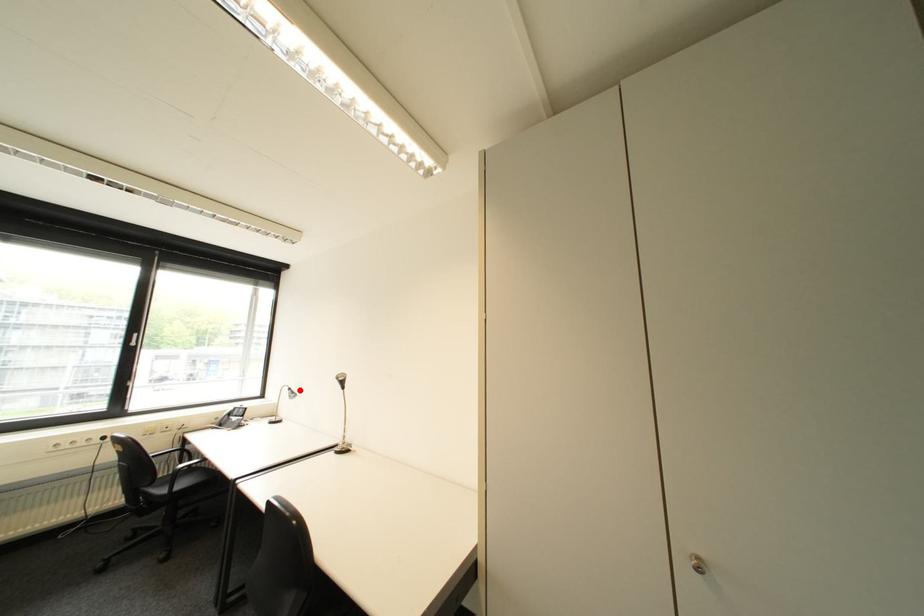
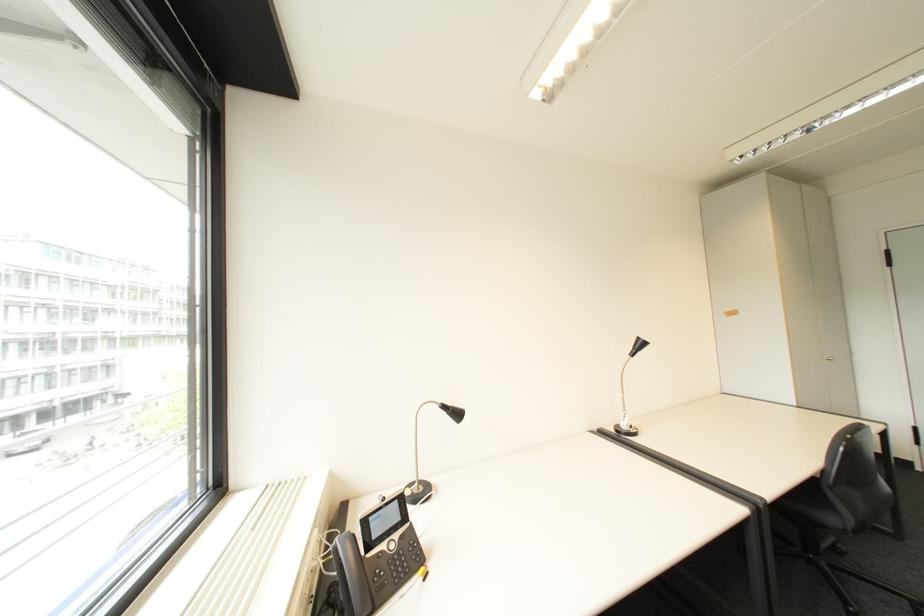
Find the pixel in the second image that matches the highlighted location in the first image.

(455, 407)